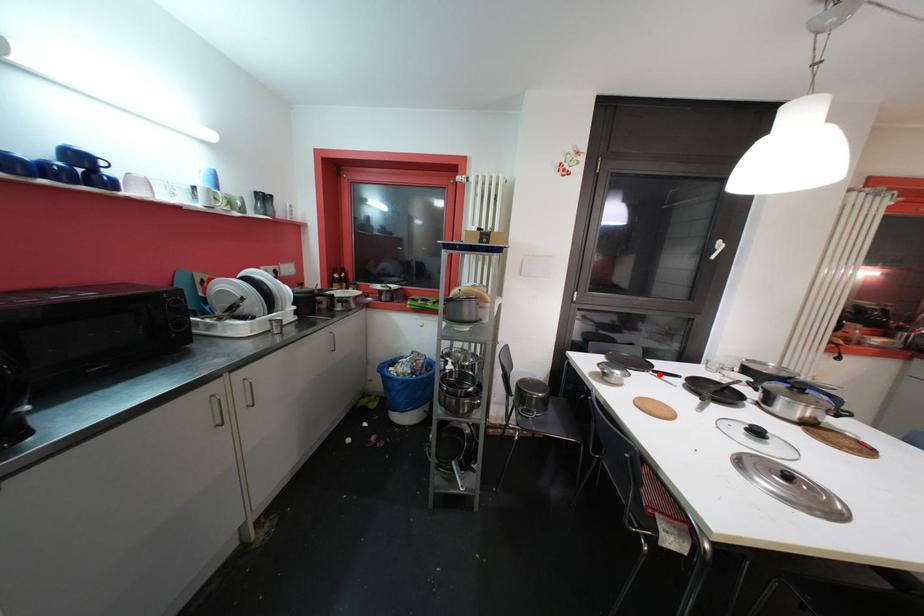
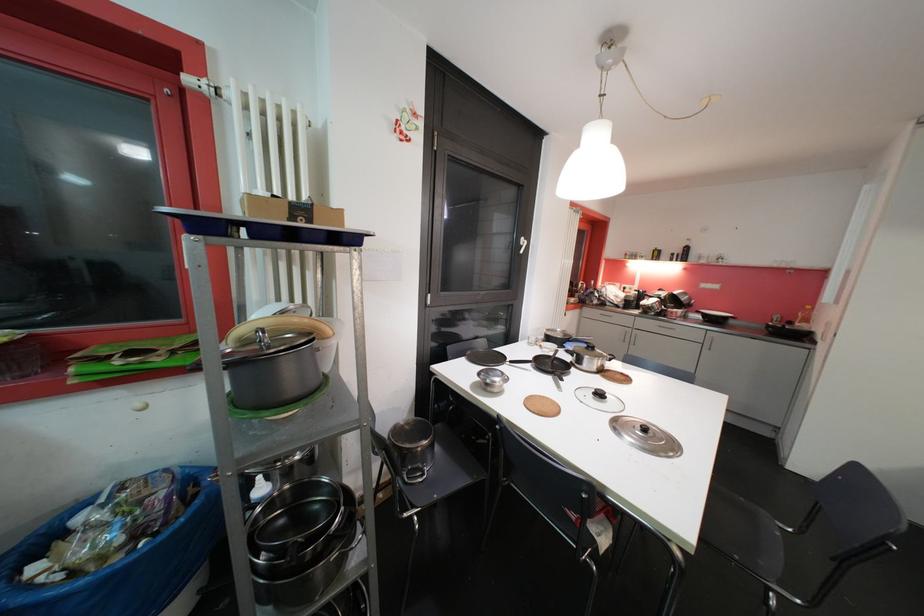
Locate, in the second image, the point that corresponds to the highlighted location in the first image.

(516, 363)